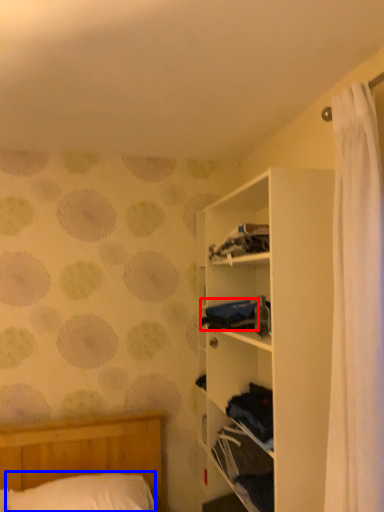
Question: Which point is further to the camera, clothing (highlighted by a red box) or pillow (highlighted by a blue box)?

Choices:
 (A) clothing
 (B) pillow

Answer: (A)